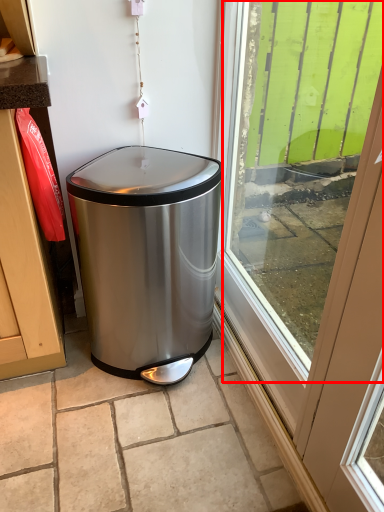
Question: Observing the image, what is the correct spatial positioning of window screen (annotated by the red box) in reference to waste container?

Choices:
 (A) right
 (B) left

Answer: (A)